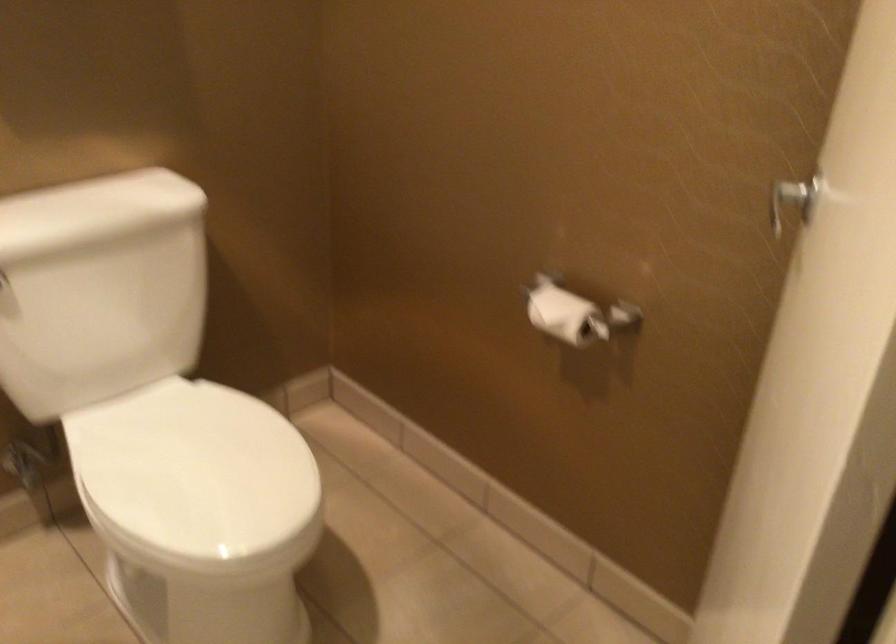
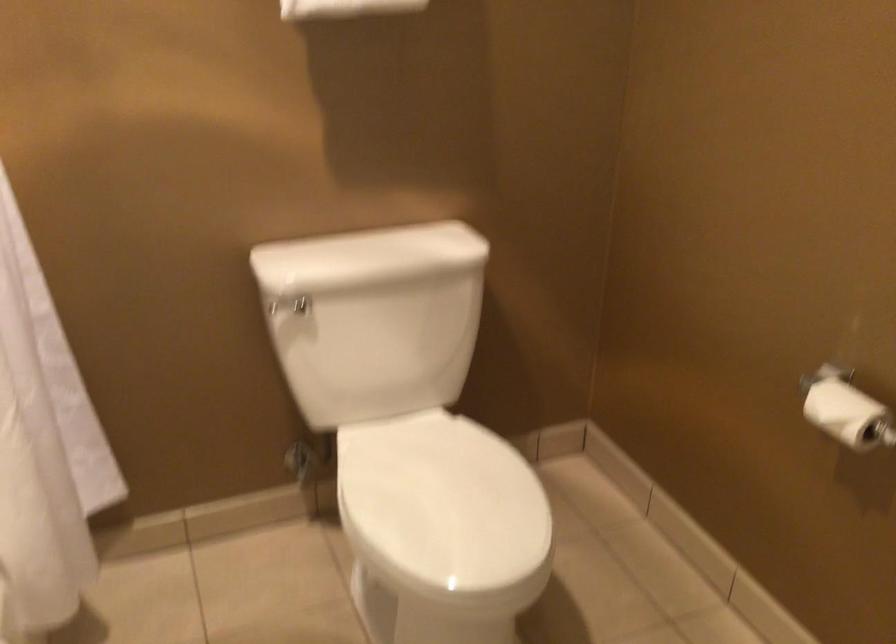
Locate, in the second image, the point that corresponds to pixel 565 315 in the first image.

(847, 413)